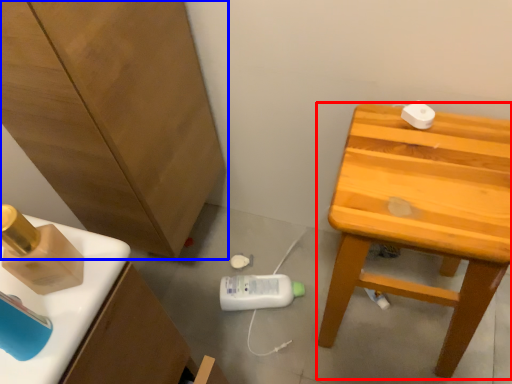
Question: Which of the following is the closest to the observer, stool (highlighted by a red box) or cabinetry (highlighted by a blue box)?

Choices:
 (A) stool
 (B) cabinetry

Answer: (B)